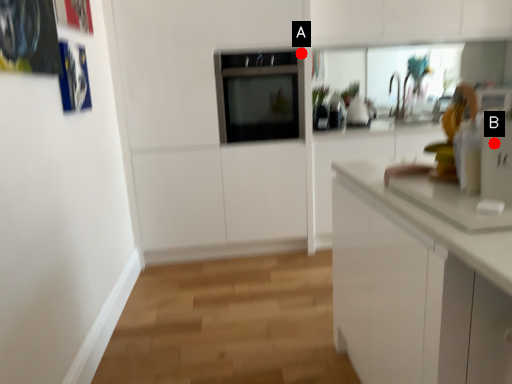
Question: Two points are circled on the image, labeled by A and B beside each circle. Which point is further to the camera?

Choices:
 (A) A is further
 (B) B is further

Answer: (A)